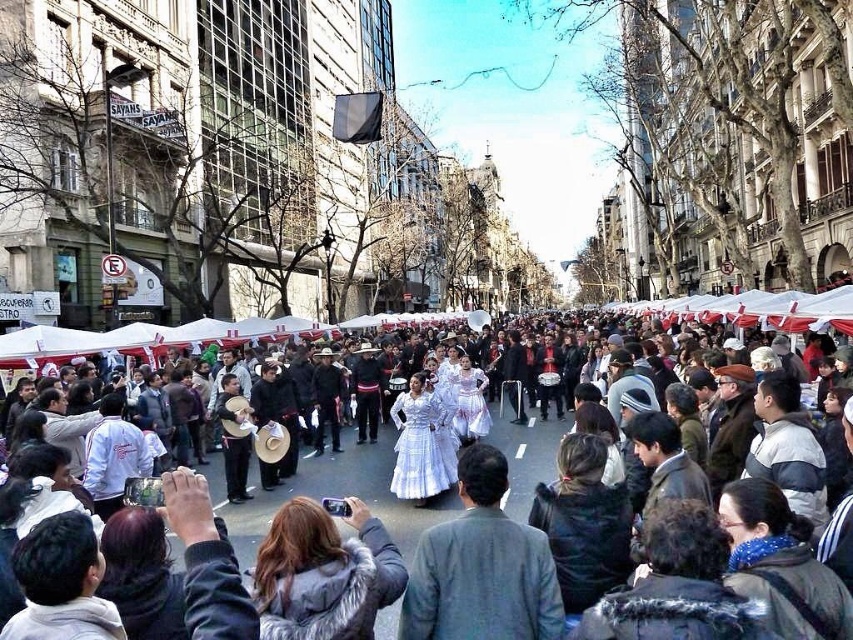
Question: Among these points, which one is nearest to the camera?

Choices:
 (A) (202, 468)
 (B) (463, 525)

Answer: (B)

Question: Does white lace dress at center have a larger size compared to white cotton dress at center?

Choices:
 (A) no
 (B) yes

Answer: (A)

Question: Which of the following is the closest to the observer?

Choices:
 (A) (302, 493)
 (B) (498, 621)

Answer: (B)

Question: Can you confirm if white lace dress at center is positioned below white cotton dress at center?

Choices:
 (A) yes
 (B) no

Answer: (A)

Question: Which point is closer to the camera?

Choices:
 (A) white cotton dress at center
 (B) white lace dress at center

Answer: (B)

Question: Where is white lace dress at center located in relation to white cotton dress at center in the image?

Choices:
 (A) below
 (B) above

Answer: (A)